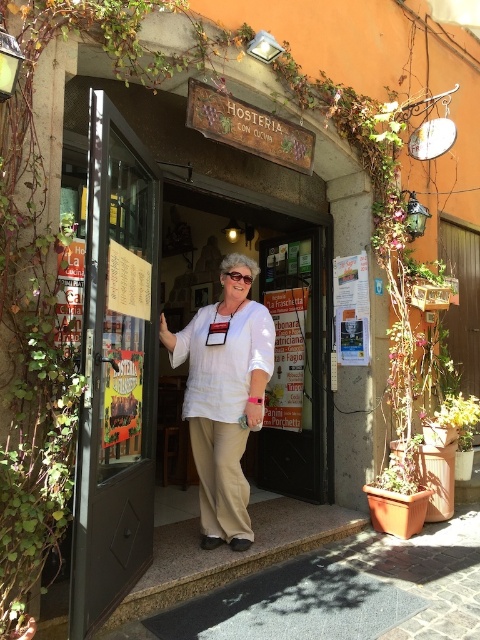
Question: Is white cotton shirt at center below clear plastic goggles at center?

Choices:
 (A) no
 (B) yes

Answer: (B)

Question: Based on their relative distances, which object is farther from the black wooden door at center?

Choices:
 (A) white fabric door at center
 (B) white cotton shirt at center

Answer: (B)

Question: Can you confirm if white fabric door at center is positioned below white cotton shirt at center?

Choices:
 (A) yes
 (B) no

Answer: (B)

Question: Considering the real-world distances, which object is farthest from the white fabric door at center?

Choices:
 (A) white cotton shirt at center
 (B) dark brown wood door at left
 (C) black wooden door at center
 (D) clear plastic goggles at center

Answer: (B)

Question: Does dark brown wood door at left appear on the left side of black wooden door at center?

Choices:
 (A) no
 (B) yes

Answer: (B)

Question: Which point is farther to the camera?

Choices:
 (A) dark brown wood door at left
 (B) white cotton shirt at center
 (C) clear plastic goggles at center

Answer: (C)